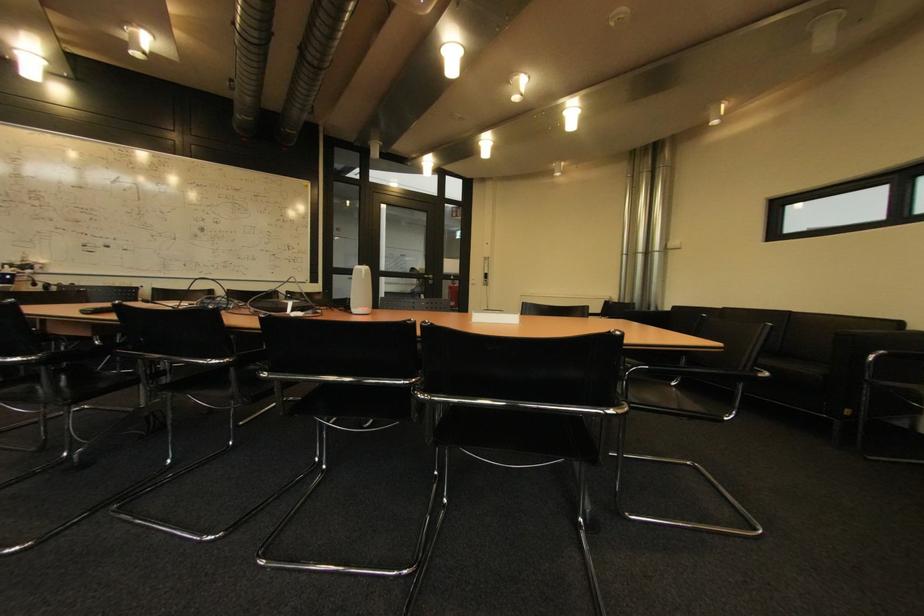
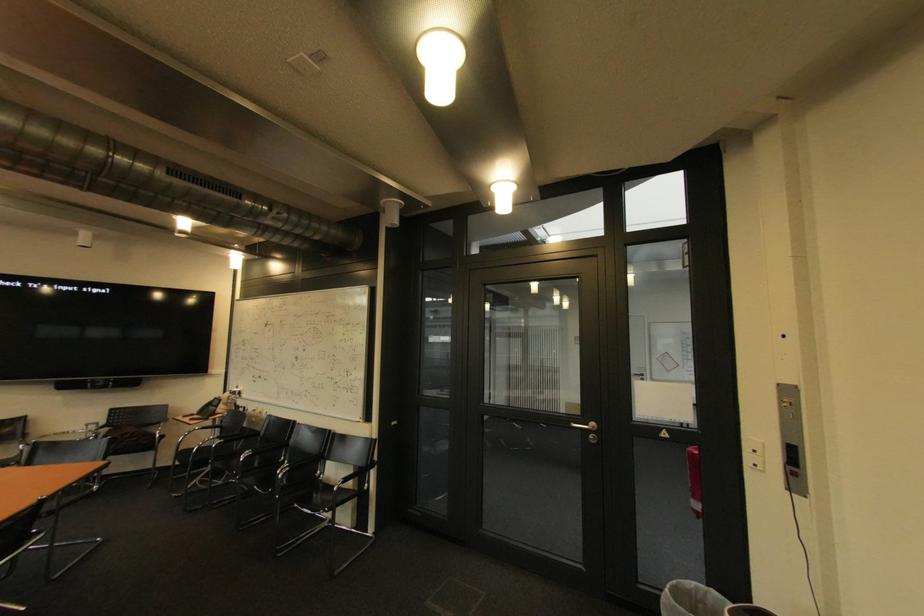
Question: I am providing you with two images of the same scene from different viewpoints. After the viewpoint changes to image2, which objects are now occluded?

Choices:
 (A) black phone handset
 (B) black chair armrest
 (C) red fire extinguisher
 (D) none of these

Answer: (D)